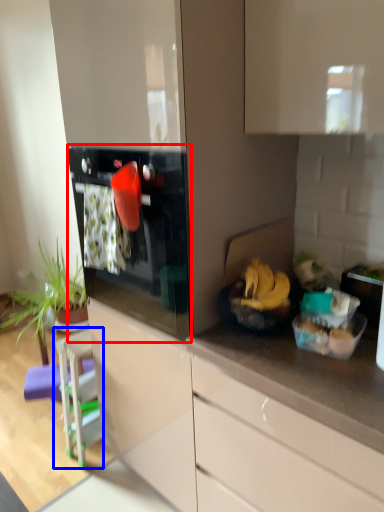
Question: Which object appears closest to the camera in this image, oven (highlighted by a red box) or appliance (highlighted by a blue box)?

Choices:
 (A) oven
 (B) appliance

Answer: (A)